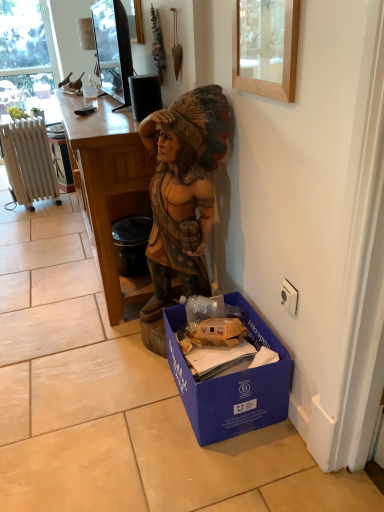
Question: From the image's perspective, is blue cardboard box at lower right located above or below black glossy tv at upper center?

Choices:
 (A) above
 (B) below

Answer: (B)

Question: In terms of width, does blue cardboard box at lower right look wider or thinner when compared to black glossy tv at upper center?

Choices:
 (A) wide
 (B) thin

Answer: (A)

Question: Which of these objects is positioned farthest from the wooden frame at upper center?

Choices:
 (A) white painted metal radiator at left
 (B) wooden desk at center
 (C) wooden statue at center
 (D) black glossy tv at upper center
 (E) blue cardboard box at lower right

Answer: (A)

Question: Which of these objects is positioned closest to the white painted metal radiator at left?

Choices:
 (A) black glossy tv at upper center
 (B) wooden frame at upper center
 (C) blue cardboard box at lower right
 (D) wooden desk at center
 (E) wooden statue at center

Answer: (A)